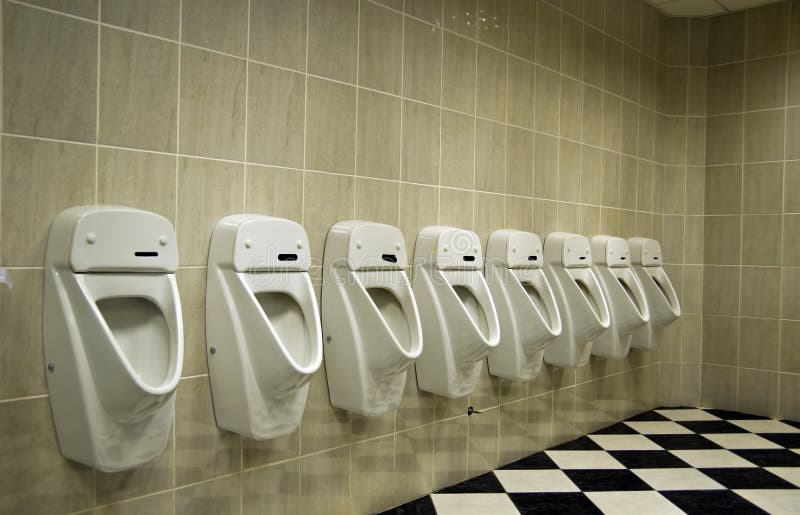
In order to click on urinals in this screenshot , I will do `click(136, 337)`, `click(270, 309)`, `click(398, 309)`, `click(486, 309)`, `click(552, 309)`, `click(606, 308)`, `click(636, 306)`, `click(668, 294)`.